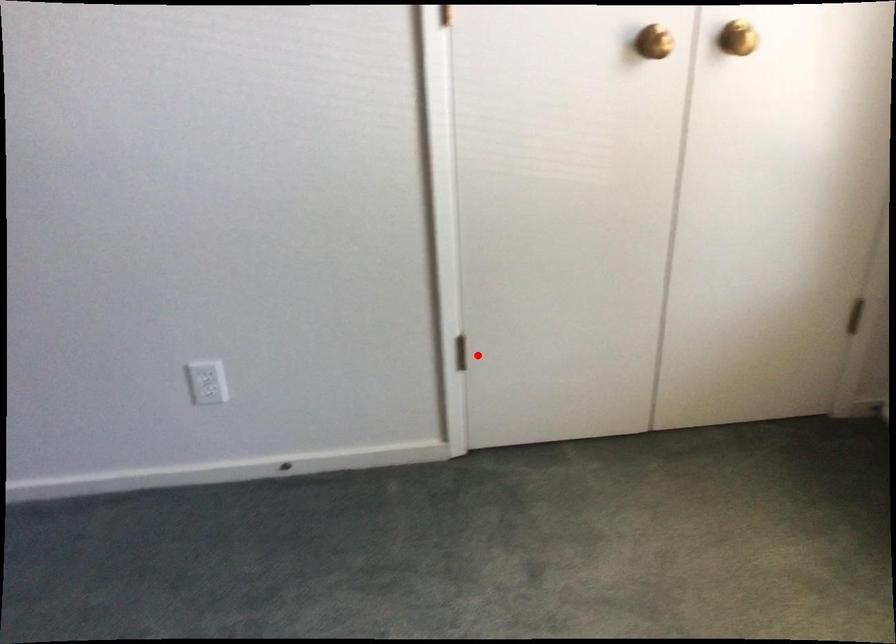
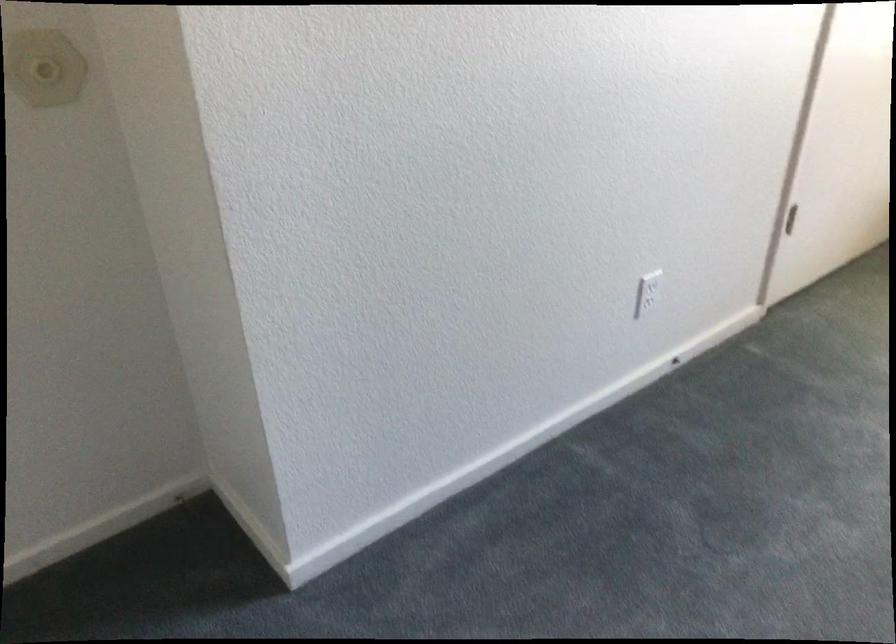
Locate, in the second image, the point that corresponds to the highlighted location in the first image.

(790, 219)